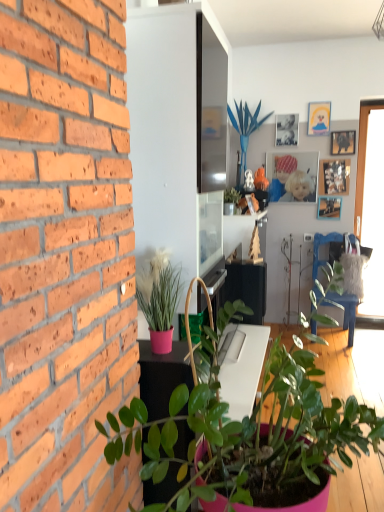
Question: Is pink matte plant at left, which is counted as the 2th houseplant, starting from the front, smaller than wooden picture frame at upper right, which is counted as the 1th picture frame, starting from the bottom?

Choices:
 (A) yes
 (B) no

Answer: (B)

Question: Does pink matte plant at left, which is counted as the 2th houseplant, starting from the front, have a greater width compared to wooden picture frame at upper right, marked as the 6th picture frame in a top-to-bottom arrangement?

Choices:
 (A) no
 (B) yes

Answer: (B)

Question: Can you confirm if pink matte plant at left, which is counted as the 2th houseplant, starting from the front, is shorter than wooden picture frame at upper right, marked as the 6th picture frame in a top-to-bottom arrangement?

Choices:
 (A) no
 (B) yes

Answer: (A)

Question: Is pink matte plant at left, which is counted as the 2th houseplant, starting from the front, aimed at wooden picture frame at upper right, which is counted as the 1th picture frame, starting from the bottom?

Choices:
 (A) yes
 (B) no

Answer: (B)

Question: From the image's perspective, does pink matte plant at left, which is the 3th houseplant from back to front, appear lower than wooden picture frame at upper right, marked as the 6th picture frame in a top-to-bottom arrangement?

Choices:
 (A) no
 (B) yes

Answer: (B)

Question: Considering the positions of transparent glass window at right and blue artificial plant at center, acting as the 1th houseplant starting from the back, in the image, is transparent glass window at right taller or shorter than blue artificial plant at center, acting as the 1th houseplant starting from the back,?

Choices:
 (A) short
 (B) tall

Answer: (B)

Question: From a real-world perspective, is transparent glass window at right positioned above or below blue artificial plant at center, which appears as the fourth houseplant when ordered from the bottom?

Choices:
 (A) below
 (B) above

Answer: (A)

Question: Visually, is transparent glass window at right positioned to the left or to the right of blue artificial plant at center, acting as the 1th houseplant starting from the back?

Choices:
 (A) left
 (B) right

Answer: (B)

Question: Is point (382, 240) closer or farther from the camera than point (240, 103)?

Choices:
 (A) farther
 (B) closer

Answer: (B)

Question: Is green glossy plant at upper center, positioned as the second houseplant in top-to-bottom order, wider or thinner than wooden picture frame at upper right, which is the third picture frame in top-to-bottom order?

Choices:
 (A) wide
 (B) thin

Answer: (A)

Question: Is green glossy plant at upper center, placed as the 2th houseplant when sorted from back to front, in front of or behind wooden picture frame at upper right, the fourth picture frame in the bottom-to-top sequence, in the image?

Choices:
 (A) behind
 (B) front

Answer: (B)

Question: From the image's perspective, is green glossy plant at upper center, placed as the 2th houseplant when sorted from back to front, located above or below wooden picture frame at upper right, the fourth picture frame in the bottom-to-top sequence?

Choices:
 (A) below
 (B) above

Answer: (A)

Question: In terms of size, does green glossy plant at upper center, which ranks as the 3th houseplant in bottom-to-top order, appear bigger or smaller than wooden picture frame at upper right, which is the third picture frame in top-to-bottom order?

Choices:
 (A) big
 (B) small

Answer: (A)

Question: Is point (158, 287) closer or farther from the camera than point (238, 198)?

Choices:
 (A) farther
 (B) closer

Answer: (B)

Question: In terms of height, does pink matte plant at left, which is counted as the 2th houseplant, starting from the front, look taller or shorter compared to green glossy plant at upper center, which is the 3th houseplant in front-to-back order?

Choices:
 (A) tall
 (B) short

Answer: (A)